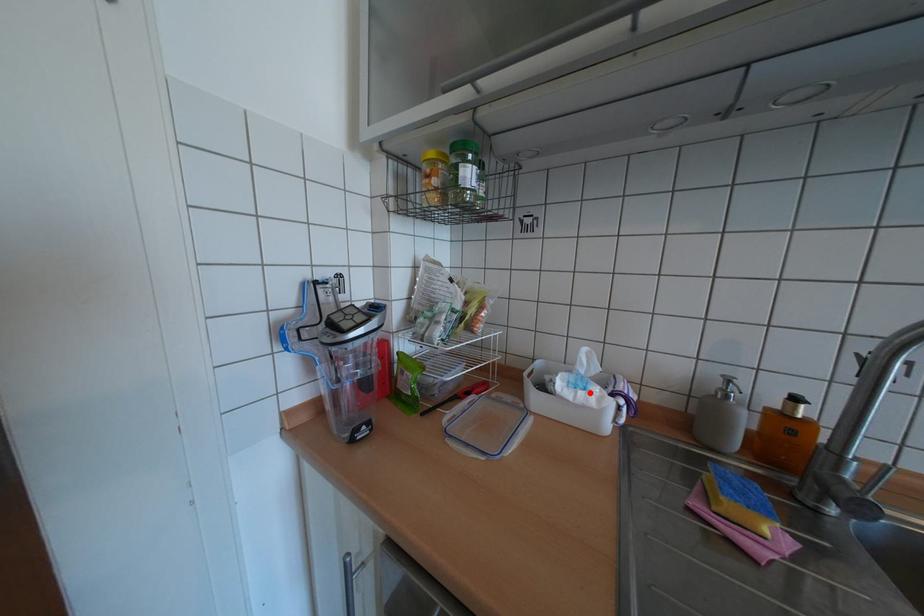
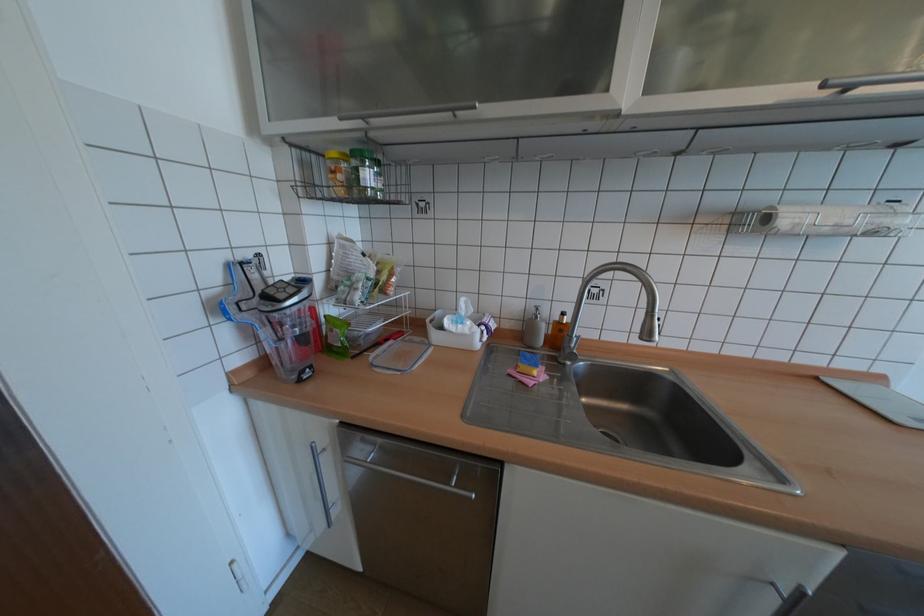
In the second image, find the point that corresponds to the highlighted location in the first image.

(468, 326)